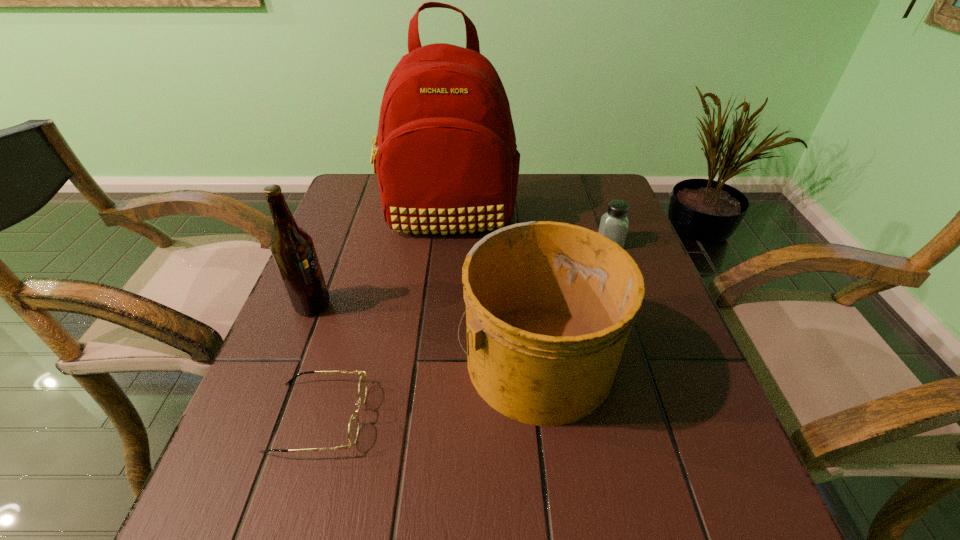
Identify the location of the tallest object. Image resolution: width=960 pixels, height=540 pixels. (446, 159).

Locate an element on the screen. This screenshot has height=540, width=960. beer bottle is located at coordinates (292, 247).

This screenshot has height=540, width=960. I want to click on bucket, so click(x=549, y=305).

At what (x,y) coordinates should I click in order to perform the action: click on saltshaker. Please return your answer as a coordinate pair (x, y). Looking at the image, I should click on (614, 223).

Where is `the rightmost object`? the rightmost object is located at coordinates (614, 223).

This screenshot has height=540, width=960. I want to click on the shortest object, so click(x=353, y=429).

Locate an element on the screen. The height and width of the screenshot is (540, 960). vacant point located 0.170m on the front-facing side of the tallest object is located at coordinates (442, 289).

In order to click on vacant space located 0.090m on the label of the fourth shortest object in this screenshot , I will do `click(371, 305)`.

I want to click on free location located on the left of the bucket, so click(x=351, y=357).

Find the location of a particular element. Image resolution: width=960 pixels, height=540 pixels. vacant region located 0.160m on the left of the saltshaker is located at coordinates (536, 243).